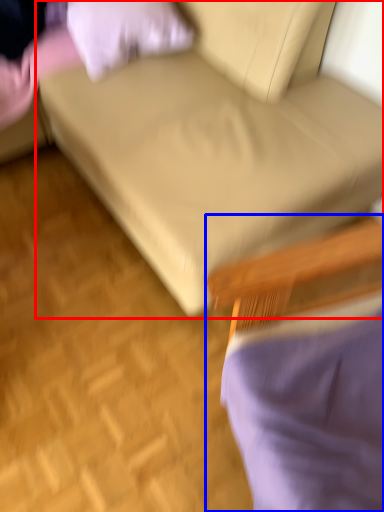
Question: Which of the following is the closest to the observer, studio couch (highlighted by a red box) or chair (highlighted by a blue box)?

Choices:
 (A) studio couch
 (B) chair

Answer: (B)